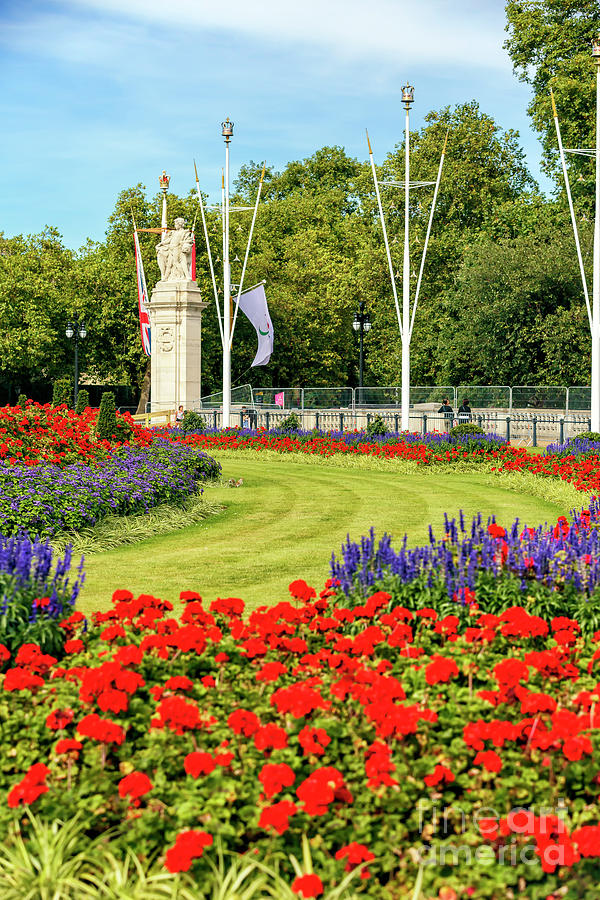
What are the coordinates of `statue` in the screenshot? It's located at (179, 328).